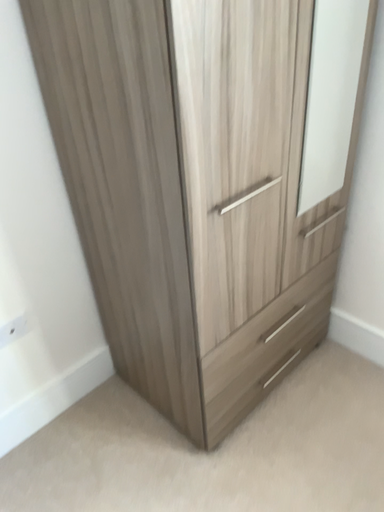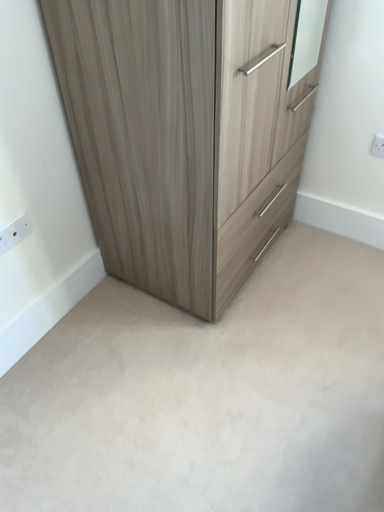
Question: Which way did the camera rotate in the video?

Choices:
 (A) rotated downward
 (B) rotated upward

Answer: (A)